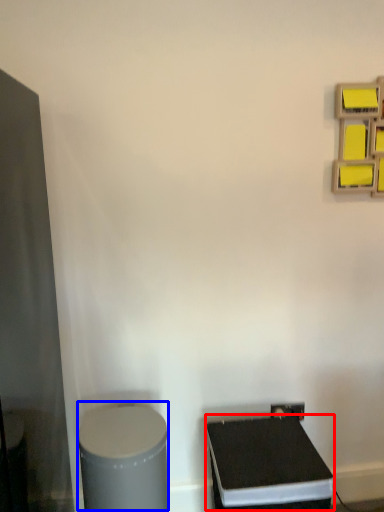
Question: Which point is closer to the camera, wide (highlighted by a red box) or wide (highlighted by a blue box)?

Choices:
 (A) wide
 (B) wide

Answer: (B)